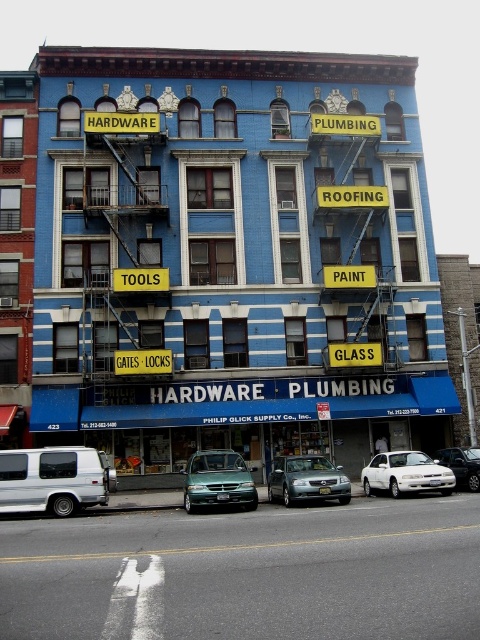
Which is below, blue brick building at center or metallic silver sedan at center?

metallic silver sedan at center

Consider the image. Does blue brick building at center appear on the right side of metallic silver sedan at center?

In fact, blue brick building at center is to the left of metallic silver sedan at center.

What do you see at coordinates (233, 257) in the screenshot? I see `blue brick building at center` at bounding box center [233, 257].

The image size is (480, 640). I want to click on blue brick building at center, so click(233, 257).

Based on the photo, between metal fire escape at left and green matte van at center, which one is positioned higher?

metal fire escape at left is above.

Which of these two, metal fire escape at left or green matte van at center, stands taller?

metal fire escape at left

At what (x,y) coordinates should I click in order to perform the action: click on metal fire escape at left. Please return your answer as a coordinate pair (x, y). This screenshot has width=480, height=640. Looking at the image, I should click on (126, 253).

Can you confirm if green matte van at center is positioned to the right of metallic silver sedan at center?

Incorrect, green matte van at center is not on the right side of metallic silver sedan at center.

Who is positioned more to the left, green matte van at center or metallic silver sedan at center?

From the viewer's perspective, green matte van at center appears more on the left side.

Where is `green matte van at center`? This screenshot has width=480, height=640. green matte van at center is located at coordinates (217, 481).